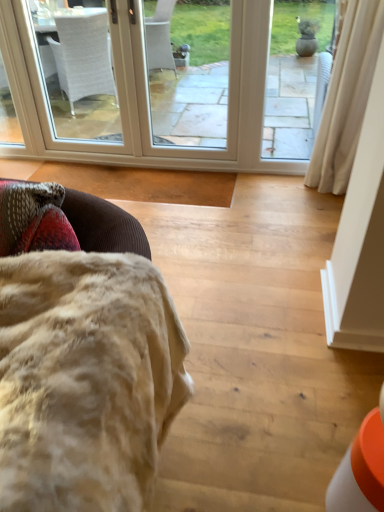
Find the location of a particular element. fuzzy beige blanket at lower left is located at coordinates (85, 379).

Image resolution: width=384 pixels, height=512 pixels. Describe the element at coordinates (85, 379) in the screenshot. I see `fuzzy beige blanket at lower left` at that location.

Locate an element on the screen. The image size is (384, 512). fuzzy beige blanket at lower left is located at coordinates (85, 379).